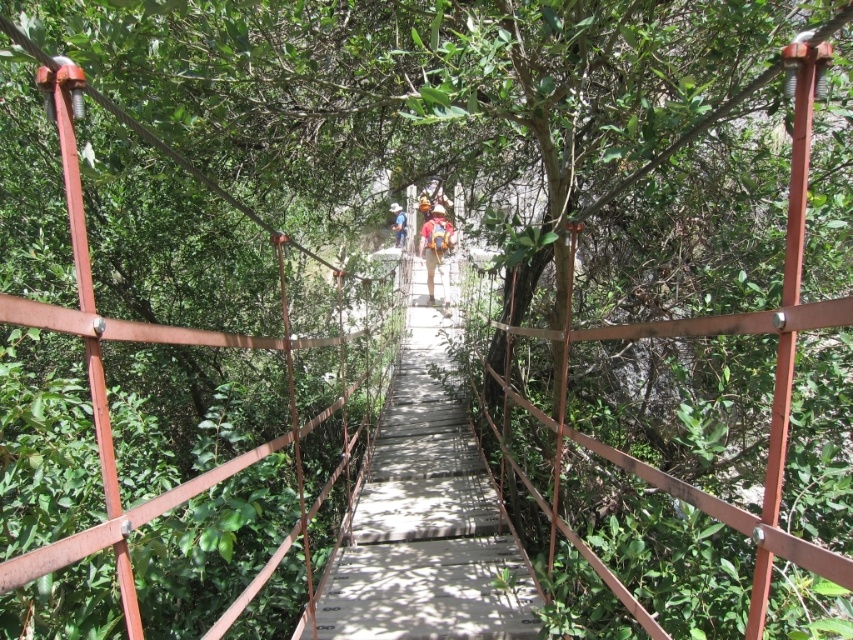
Question: Observing the image, what is the correct spatial positioning of wooden bridge at center in reference to light blue denim shirt at center?

Choices:
 (A) above
 (B) below

Answer: (B)

Question: Can you confirm if wooden bridge at center is positioned below camouflage fabric backpack at center?

Choices:
 (A) yes
 (B) no

Answer: (A)

Question: Can you confirm if wooden bridge at center is positioned above light blue denim shirt at center?

Choices:
 (A) yes
 (B) no

Answer: (B)

Question: Which object is positioned farthest from the camouflage fabric backpack at center?

Choices:
 (A) light blue denim shirt at center
 (B) wooden bridge at center

Answer: (B)

Question: Which point is closer to the camera taking this photo?

Choices:
 (A) (440, 259)
 (B) (399, 244)
 (C) (363, 493)

Answer: (C)

Question: Which point is farther from the camera taking this photo?

Choices:
 (A) (448, 305)
 (B) (401, 220)

Answer: (A)